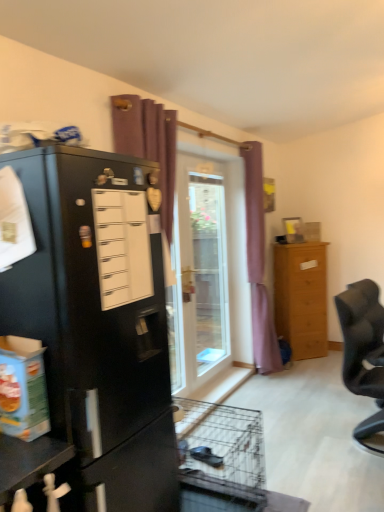
Question: Is transparent glass door at center oriented away from purple fabric curtain at center, marked as the second curtain in a left-to-right arrangement?

Choices:
 (A) yes
 (B) no

Answer: (B)

Question: From the image's perspective, is transparent glass door at center located beneath purple fabric curtain at center, which is the 1th curtain in right-to-left order?

Choices:
 (A) yes
 (B) no

Answer: (A)

Question: Does transparent glass door at center have a greater height compared to purple fabric curtain at center, which is the 1th curtain in right-to-left order?

Choices:
 (A) yes
 (B) no

Answer: (B)

Question: From a real-world perspective, is transparent glass door at center located higher than purple fabric curtain at center, marked as the second curtain in a left-to-right arrangement?

Choices:
 (A) no
 (B) yes

Answer: (A)

Question: Could you tell me if transparent glass door at center is turned towards purple fabric curtain at center, marked as the second curtain in a front-to-back arrangement?

Choices:
 (A) yes
 (B) no

Answer: (A)

Question: Considering their positions, is purple fabric curtain at center, marked as the second curtain in a front-to-back arrangement, located in front of or behind light brown wooden chest of drawers at right?

Choices:
 (A) front
 (B) behind

Answer: (A)

Question: Would you say purple fabric curtain at center, marked as the second curtain in a front-to-back arrangement, is to the left or to the right of light brown wooden chest of drawers at right in the picture?

Choices:
 (A) left
 (B) right

Answer: (A)

Question: Is point (248, 160) positioned closer to the camera than point (278, 251)?

Choices:
 (A) closer
 (B) farther

Answer: (A)

Question: Would you say purple fabric curtain at center, marked as the second curtain in a front-to-back arrangement, is inside or outside light brown wooden chest of drawers at right?

Choices:
 (A) inside
 (B) outside

Answer: (B)

Question: From their relative heights in the image, would you say transparent glass door at center is taller or shorter than black fabric chair at right?

Choices:
 (A) short
 (B) tall

Answer: (B)

Question: Is transparent glass door at center to the left or to the right of black fabric chair at right in the image?

Choices:
 (A) left
 (B) right

Answer: (A)

Question: Looking at the image, does transparent glass door at center seem bigger or smaller compared to black fabric chair at right?

Choices:
 (A) big
 (B) small

Answer: (A)

Question: Is transparent glass door at center inside or outside of black fabric chair at right?

Choices:
 (A) inside
 (B) outside

Answer: (B)

Question: Looking at their shapes, would you say black fabric chair at right is wider or thinner than black matte refrigerator at left?

Choices:
 (A) wide
 (B) thin

Answer: (B)

Question: From a real-world perspective, relative to black matte refrigerator at left, is black fabric chair at right vertically above or below?

Choices:
 (A) below
 (B) above

Answer: (A)